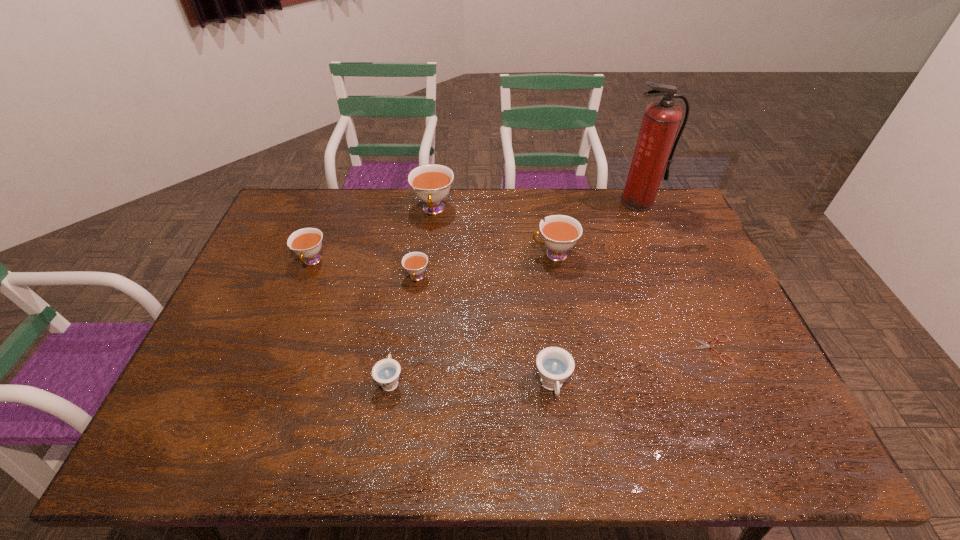
Image resolution: width=960 pixels, height=540 pixels. Find the location of `the closest white teacup to the farthest teacup`. the closest white teacup to the farthest teacup is located at coordinates (415, 263).

I want to click on white teacup that is the closest to the second tallest teacup, so click(431, 183).

The height and width of the screenshot is (540, 960). Identify the location of vacant space that satisfies the following two spatial constraints: 1. on the side of the sixth shortest object with the handle; 2. on the side of the smallest white teacup with the handle. (558, 278).

Where is `vacant region that satisfies the following two spatial constraints: 1. at the nozzle of the fire extinguisher; 2. on the side of the second biggest white teacup with the handle`? The width and height of the screenshot is (960, 540). vacant region that satisfies the following two spatial constraints: 1. at the nozzle of the fire extinguisher; 2. on the side of the second biggest white teacup with the handle is located at coordinates (660, 254).

The image size is (960, 540). Identify the location of vacant point that satisfies the following two spatial constraints: 1. on the side of the left blue teacup with the handle; 2. on the left side of the sixth farthest object. (396, 349).

Image resolution: width=960 pixels, height=540 pixels. Identify the location of free space that satisfies the following two spatial constraints: 1. at the nozzle of the red fire extinguisher; 2. on the side of the third tallest object with the handle. (660, 254).

You are a GUI agent. You are given a task and a screenshot of the screen. Output one action in this format:
    pyautogui.click(x=<x>, y=<y>)
    Task: Click on the vacant point that satisfies the following two spatial constraints: 1. on the side of the rightmost white teacup with the handle; 2. on the side of the smallest white teacup with the handle
    
    Given the screenshot: What is the action you would take?
    pyautogui.click(x=558, y=278)

Find the location of a particular element. Image resolution: width=960 pixels, height=540 pixels. vacant position in the image that satisfies the following two spatial constraints: 1. on the side of the third nearest object with the handle; 2. on the right side of the smallest white teacup is located at coordinates (407, 349).

Locate an element on the screen. The width and height of the screenshot is (960, 540). free space in the image that satisfies the following two spatial constraints: 1. on the side of the sixth farthest object with the handle; 2. on the left side of the rightmost white teacup is located at coordinates (570, 349).